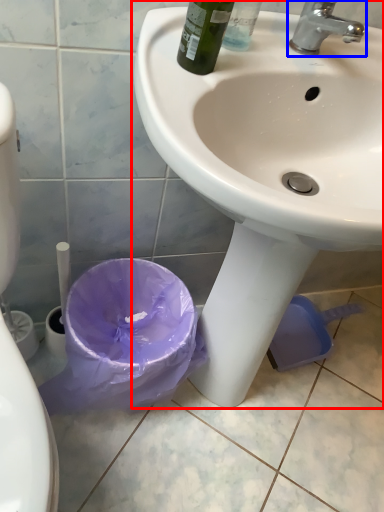
Question: Which point is further to the camera, sink (highlighted by a red box) or tap (highlighted by a blue box)?

Choices:
 (A) sink
 (B) tap

Answer: (B)